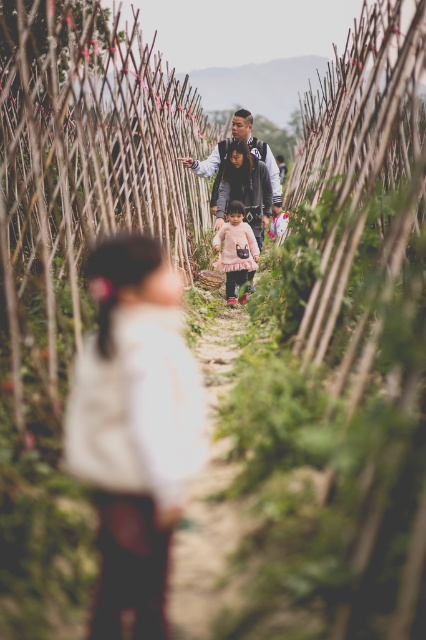
Question: Does matte pink sweater at center have a smaller size compared to dark gray jacket at center?

Choices:
 (A) yes
 (B) no

Answer: (B)

Question: Which point appears closest to the camera in this image?

Choices:
 (A) (222, 262)
 (B) (242, 147)
 (C) (143, 472)

Answer: (C)

Question: Can you confirm if pink tulle dress at center is positioned to the left of dark gray jacket at center?

Choices:
 (A) no
 (B) yes

Answer: (A)

Question: Which point is farther to the camera?

Choices:
 (A) white soft sweater at center
 (B) matte pink sweater at center
 (C) pink tulle dress at center
 (D) dark gray jacket at center

Answer: (D)

Question: Can you confirm if pink tulle dress at center is thinner than dark gray jacket at center?

Choices:
 (A) yes
 (B) no

Answer: (B)

Question: Which object appears closest to the camera in this image?

Choices:
 (A) white soft sweater at center
 (B) dark gray jacket at center
 (C) pink tulle dress at center

Answer: (A)